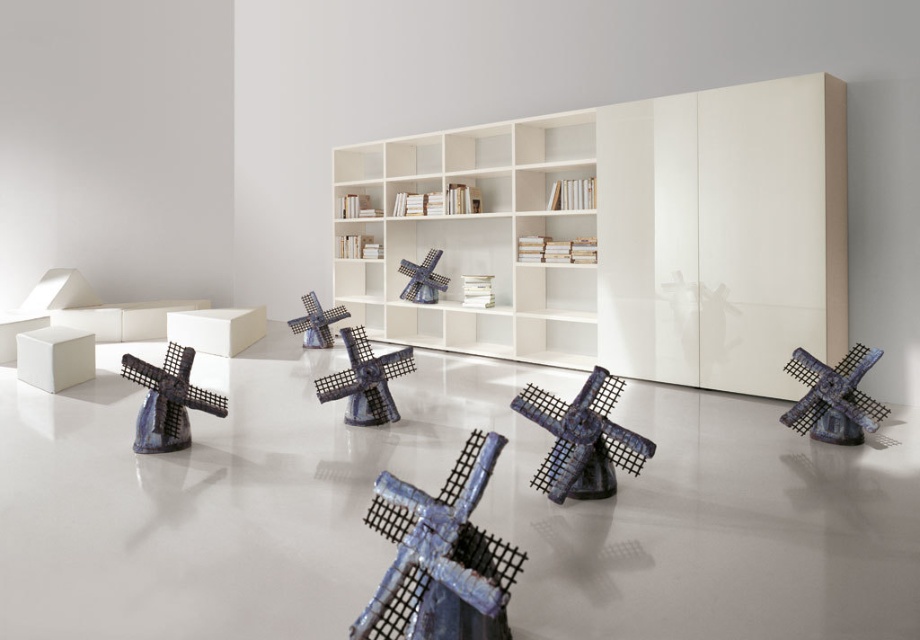
Is point (536, 396) less distant than point (167, 419)?

Yes, it is in front of point (167, 419).

Does shiny blue windmill at center come behind shiny blue windmill at lower left?

No, shiny blue windmill at center is in front of shiny blue windmill at lower left.

Is point (589, 492) positioned after point (150, 392)?

No, it is not.

What are the coordinates of `shiny blue windmill at center` in the screenshot? It's located at (582, 438).

Is shiny blue windmill at center above blue ceramic windmill at center?

Incorrect, shiny blue windmill at center is not positioned above blue ceramic windmill at center.

Looking at this image, is shiny blue windmill at center wider than blue ceramic windmill at center?

Yes.

The width and height of the screenshot is (920, 640). I want to click on shiny blue windmill at center, so click(582, 438).

You are a GUI agent. You are given a task and a screenshot of the screen. Output one action in this format:
    pyautogui.click(x=<x>, y=<y>)
    Task: Click on the shiny blue windmill at center
    
    Given the screenshot: What is the action you would take?
    pyautogui.click(x=582, y=438)

Can you confirm if blue metallic windmill at center is shorter than blue ceramic windmill at center?

Incorrect, blue metallic windmill at center's height does not fall short of blue ceramic windmill at center's.

Locate an element on the screen. blue metallic windmill at center is located at coordinates (440, 556).